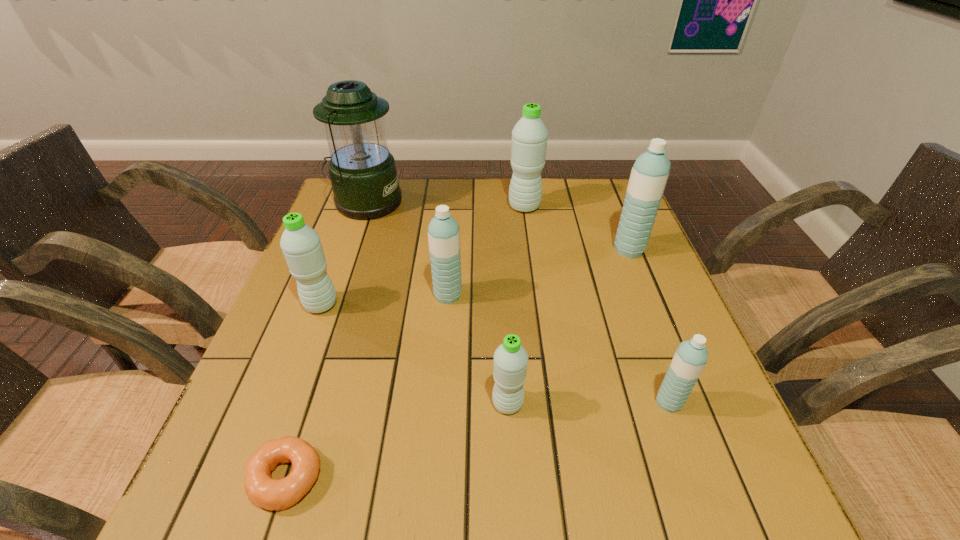
Locate an element on the screen. This screenshot has width=960, height=540. free space at the far edge is located at coordinates (476, 182).

You are a GUI agent. You are given a task and a screenshot of the screen. Output one action in this format:
    pyautogui.click(x=<x>, y=<y>)
    Task: Click on the blank space at the near edge
    
    Given the screenshot: What is the action you would take?
    pyautogui.click(x=591, y=520)

You are a GUI agent. You are given a task and a screenshot of the screen. Output one action in this format:
    pyautogui.click(x=<x>, y=<y>)
    Task: Click on the free space at the left edge of the desktop
    This screenshot has height=540, width=960.
    Given the screenshot: What is the action you would take?
    pyautogui.click(x=276, y=402)

Where is `vacant area at the right edge of the desktop`? This screenshot has width=960, height=540. vacant area at the right edge of the desktop is located at coordinates (639, 311).

Locate an element on the screen. This screenshot has height=540, width=960. free space at the far right corner is located at coordinates pyautogui.click(x=619, y=178).

You are a GUI agent. You are given a task and a screenshot of the screen. Output one action in this format:
    pyautogui.click(x=<x>, y=<y>)
    Task: Click on the vacant point located between the leftmost green water bottle and the second nearest blue water bottle
    The width and height of the screenshot is (960, 540).
    Given the screenshot: What is the action you would take?
    coord(385,300)

The image size is (960, 540). Find the location of `vacant region between the second farthest water bottle and the leftmost green water bottle`. vacant region between the second farthest water bottle and the leftmost green water bottle is located at coordinates (475, 277).

Find the location of a particular element. free space between the smallest blue water bottle and the leftmost blue water bottle is located at coordinates (559, 349).

Find the location of `vacant area that lies between the second biggest green water bottle and the farthest blue water bottle`. vacant area that lies between the second biggest green water bottle and the farthest blue water bottle is located at coordinates (475, 277).

Identify the location of free space between the farthest blue water bottle and the lantern. The height and width of the screenshot is (540, 960). (497, 226).